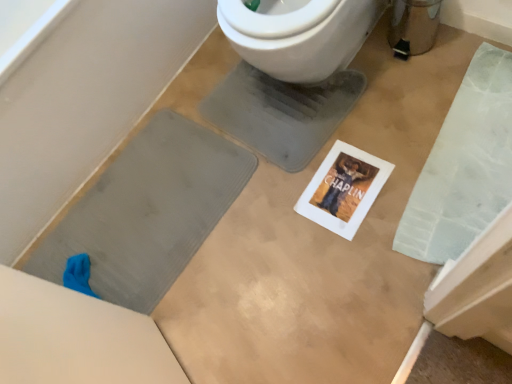
Locate an element on the screen. vacant area on top of gray rubber bath mat at left (from a real-world perspective) is located at coordinates (106, 238).